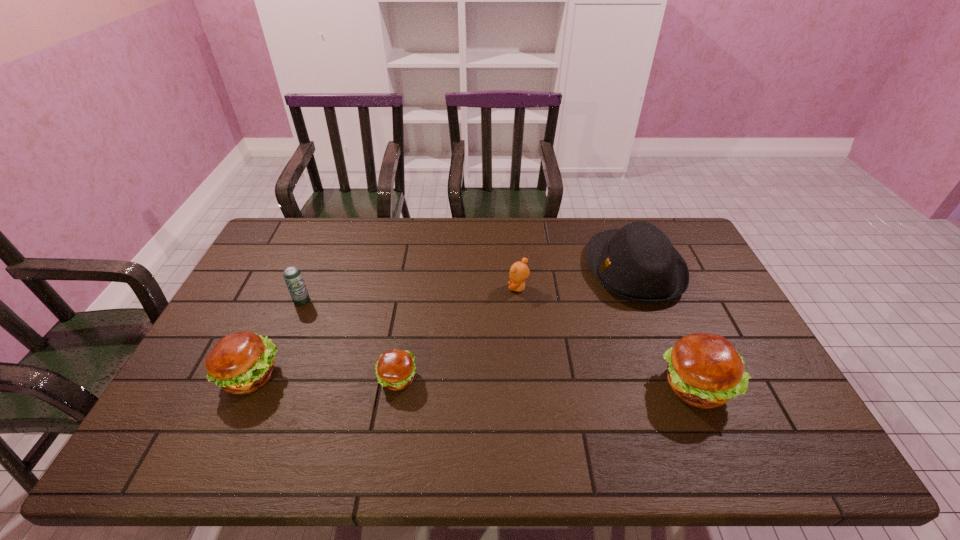
Identify the location of fedora positioned at the right edge. (637, 263).

Locate an element on the screen. object located at the near left corner is located at coordinates (240, 363).

Where is `object that is at the far right corner`? This screenshot has height=540, width=960. object that is at the far right corner is located at coordinates (637, 263).

Identify the location of object that is at the near right corner. This screenshot has height=540, width=960. (704, 370).

Locate an element on the screen. The image size is (960, 540). vacant space at the far edge is located at coordinates (577, 226).

Where is `blank area at the near edge`? blank area at the near edge is located at coordinates (446, 403).

Locate an element on the screen. This screenshot has width=960, height=540. vacant space at the left edge is located at coordinates [x=260, y=314].

Image resolution: width=960 pixels, height=540 pixels. Find the location of `vacant space at the far left corner`. vacant space at the far left corner is located at coordinates (299, 220).

Identify the location of vacant region at the near left corner of the desktop. (213, 397).

This screenshot has height=540, width=960. What are the coordinates of `free area in between the leftmost hamburger and the beer can` in the screenshot? It's located at (276, 338).